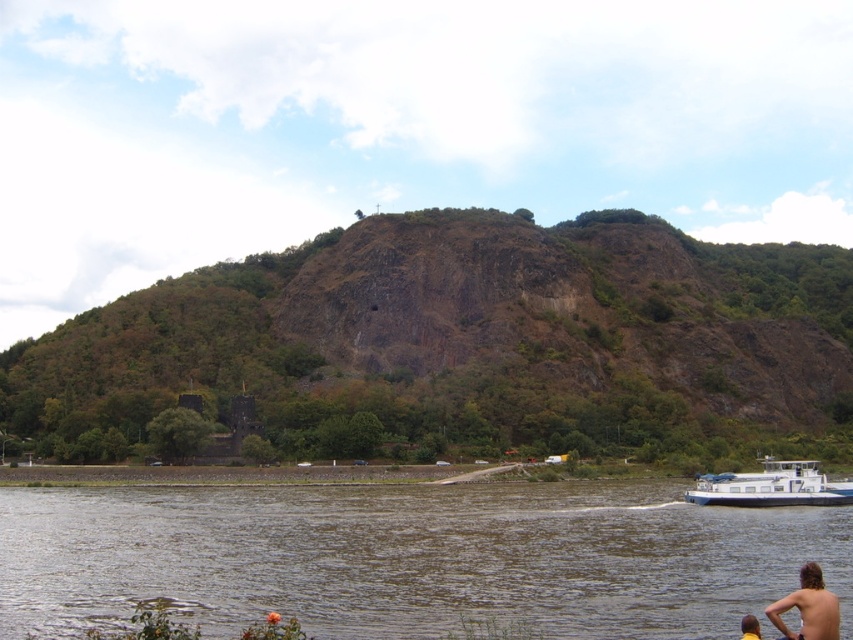
Question: Does brown rocky hillside at center have a larger size compared to brown hair at lower right?

Choices:
 (A) yes
 (B) no

Answer: (A)

Question: Does brown rocky hillside at center have a lesser width compared to brown water at lower center?

Choices:
 (A) yes
 (B) no

Answer: (B)

Question: Estimate the real-world distances between objects in this image. Which object is closer to the brown rocky hillside at center?

Choices:
 (A) white matte barge at lower right
 (B) brown hair at lower right
 (C) brown water at lower center

Answer: (A)

Question: Which of the following is the farthest from the observer?

Choices:
 (A) white matte barge at lower right
 (B) brown rocky hillside at center
 (C) brown water at lower center
 (D) brown hair at lower right

Answer: (B)

Question: Which object is the farthest from the brown water at lower center?

Choices:
 (A) brown hair at lower right
 (B) white matte barge at lower right
 (C) brown rocky hillside at center

Answer: (C)

Question: Does brown rocky hillside at center have a larger size compared to brown water at lower center?

Choices:
 (A) yes
 (B) no

Answer: (A)